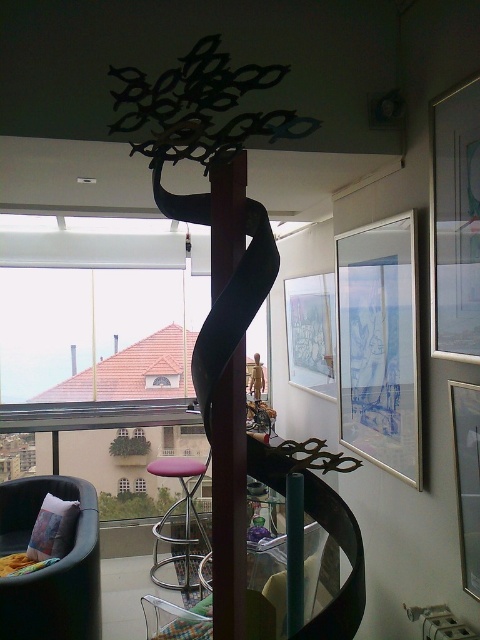
Question: Is matte glass picture frame at upper center to the right of metallic silver picture frame at right from the viewer's perspective?

Choices:
 (A) yes
 (B) no

Answer: (B)

Question: Among these objects, which one is farthest from the camera?

Choices:
 (A) purple fabric stool at center
 (B) matte glass picture frame at upper right

Answer: (A)

Question: Considering the real-world distances, which object is farthest from the velvet green armchair at lower left?

Choices:
 (A) matte glass picture frame at upper center
 (B) purple fabric stool at center
 (C) silver metallic picture frame at right
 (D) metallic silver picture frame at right

Answer: (D)

Question: Is velvet green armchair at lower left smaller than metallic silver picture frame at right?

Choices:
 (A) no
 (B) yes

Answer: (A)

Question: Which point appears closest to the camera in this image?

Choices:
 (A) (445, 333)
 (B) (300, 604)

Answer: (B)

Question: Is silver metallic picture frame at right positioned in front of metallic silver picture frame at right?

Choices:
 (A) no
 (B) yes

Answer: (A)